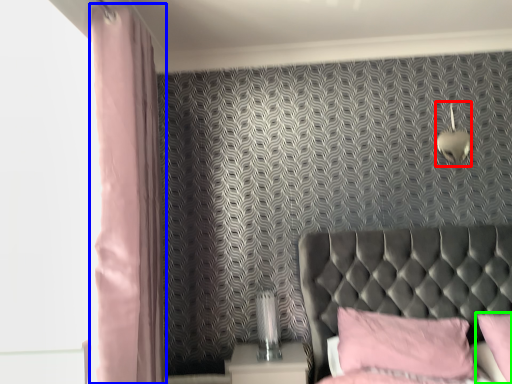
Question: Considering the real-world distances, which object is closest to light fixture (highlighted by a red box)? curtain (highlighted by a blue box) or pillow (highlighted by a green box).

Choices:
 (A) curtain
 (B) pillow

Answer: (B)